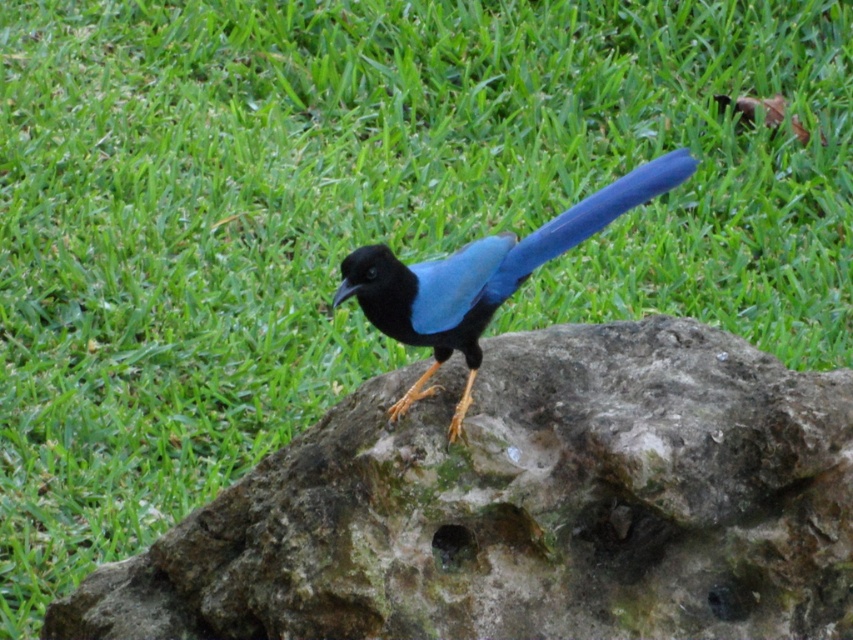
Question: Does rough stone boulder at center have a greater width compared to glossy blue bird at center?

Choices:
 (A) no
 (B) yes

Answer: (B)

Question: Which point appears farthest from the camera in this image?

Choices:
 (A) (593, 218)
 (B) (265, 566)

Answer: (B)

Question: Is rough stone boulder at center positioned before glossy blue bird at center?

Choices:
 (A) yes
 (B) no

Answer: (B)

Question: Can you confirm if rough stone boulder at center is positioned to the right of glossy blue bird at center?

Choices:
 (A) yes
 (B) no

Answer: (B)